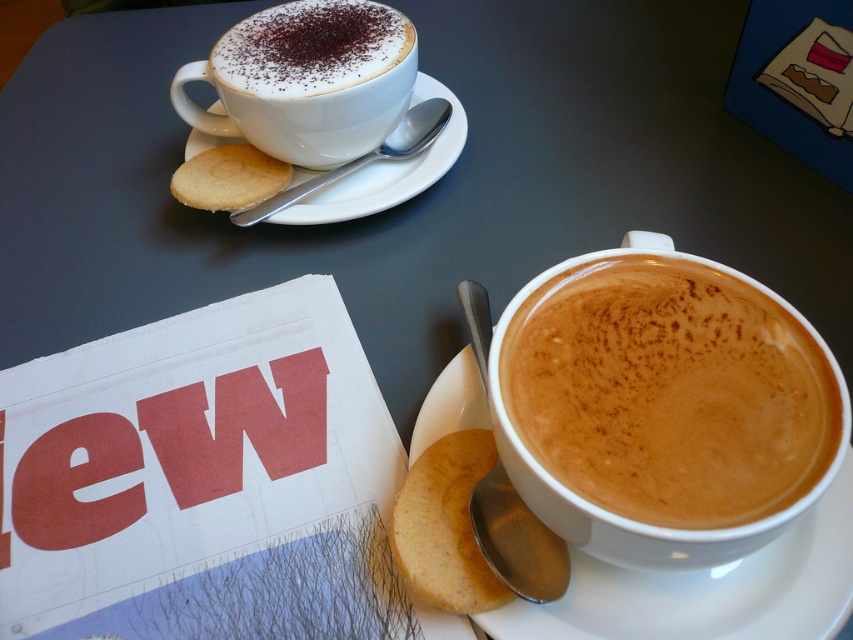
Question: Does white matte cup at upper left have a larger size compared to white ceramic saucer at upper left?

Choices:
 (A) yes
 (B) no

Answer: (B)

Question: Is cappuccino foam at lower right thinner than white ceramic saucer at upper left?

Choices:
 (A) yes
 (B) no

Answer: (A)

Question: Does white ceramic saucer at lower right appear on the right side of white matte cup at upper left?

Choices:
 (A) no
 (B) yes

Answer: (B)

Question: Which object is positioned farthest from the white ceramic saucer at upper left?

Choices:
 (A) white matte cup at upper left
 (B) golden crumbly biscuit at lower center
 (C) cappuccino foam at lower right
 (D) golden crisp cookie at upper left

Answer: (C)

Question: Which of the following is the farthest from the observer?

Choices:
 (A) golden crumbly biscuit at lower center
 (B) cappuccino foam at lower right

Answer: (A)

Question: Which of the following is the farthest from the observer?

Choices:
 (A) golden crisp cookie at upper left
 (B) white ceramic saucer at lower right
 (C) white ceramic saucer at upper left
 (D) golden crumbly biscuit at lower center

Answer: (A)